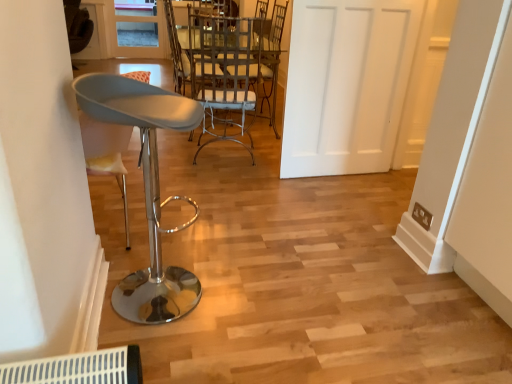
The width and height of the screenshot is (512, 384). I want to click on vacant area in front of matte gray stool at left, marked as the 2th chair in a back-to-front arrangement, so click(x=168, y=350).